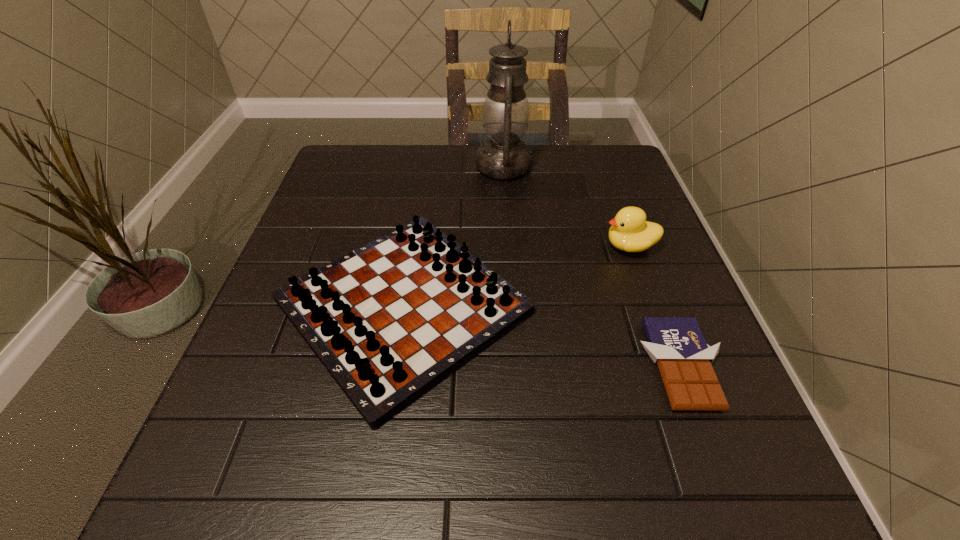
Where is `oil lamp`? The width and height of the screenshot is (960, 540). oil lamp is located at coordinates (505, 115).

Locate an element on the screen. This screenshot has width=960, height=540. the farthest object is located at coordinates (505, 115).

Identify the location of duckling. Image resolution: width=960 pixels, height=540 pixels. (630, 231).

The width and height of the screenshot is (960, 540). Identify the location of chessboard. (390, 320).

At what (x,y) coordinates should I click in order to perform the action: click on the shortest object. Please return your answer as a coordinate pair (x, y). Image resolution: width=960 pixels, height=540 pixels. Looking at the image, I should click on point(676,344).

Identify the location of free space located 0.160m on the front of the tallest object. This screenshot has width=960, height=540. (510, 227).

You are a GUI agent. You are given a task and a screenshot of the screen. Output one action in this format:
    pyautogui.click(x=<x>, y=<y>)
    Task: Click on the vacant space situated 0.390m on the beak of the duckling
    This screenshot has width=960, height=540.
    Given the screenshot: What is the action you would take?
    pyautogui.click(x=425, y=246)

Identify the location of free space located on the beak of the duckling. (489, 246).

This screenshot has width=960, height=540. What are the coordinates of `vacant space located on the beak of the duckling` in the screenshot? It's located at (530, 246).

I want to click on vacant space situated on the right of the chessboard, so click(622, 306).